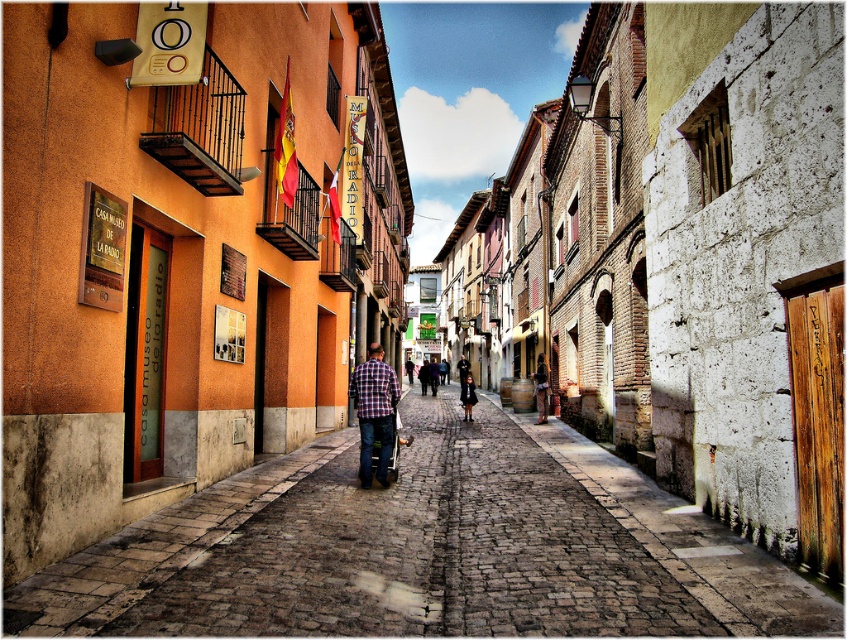
Question: Estimate the real-world distances between objects in this image. Which object is farther from the blue fabric cart at center?

Choices:
 (A) cobblestone pavement at center
 (B) matte brown leather bag at center
 (C) dark brown leather coat at center
 (D) plaid fabric shirt at center

Answer: (C)

Question: Observing the image, what is the correct spatial positioning of plaid fabric shirt at center in reference to blue fabric cart at center?

Choices:
 (A) below
 (B) above

Answer: (B)

Question: Does cobblestone pavement at center appear on the right side of plaid fabric shirt at center?

Choices:
 (A) yes
 (B) no

Answer: (A)

Question: Where is plaid fabric shirt at center located in relation to blue fabric cart at center in the image?

Choices:
 (A) above
 (B) below

Answer: (A)

Question: Which of these objects is positioned closest to the cobblestone pavement at center?

Choices:
 (A) dark brown leather coat at center
 (B) blue fabric cart at center

Answer: (B)

Question: Which object appears closest to the camera in this image?

Choices:
 (A) blue fabric cart at center
 (B) dark brown leather coat at center

Answer: (A)